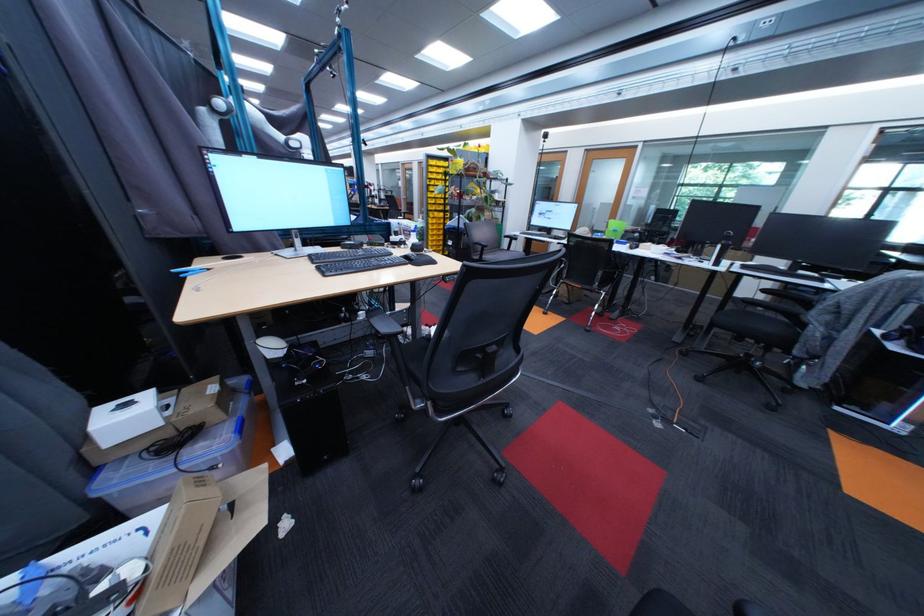
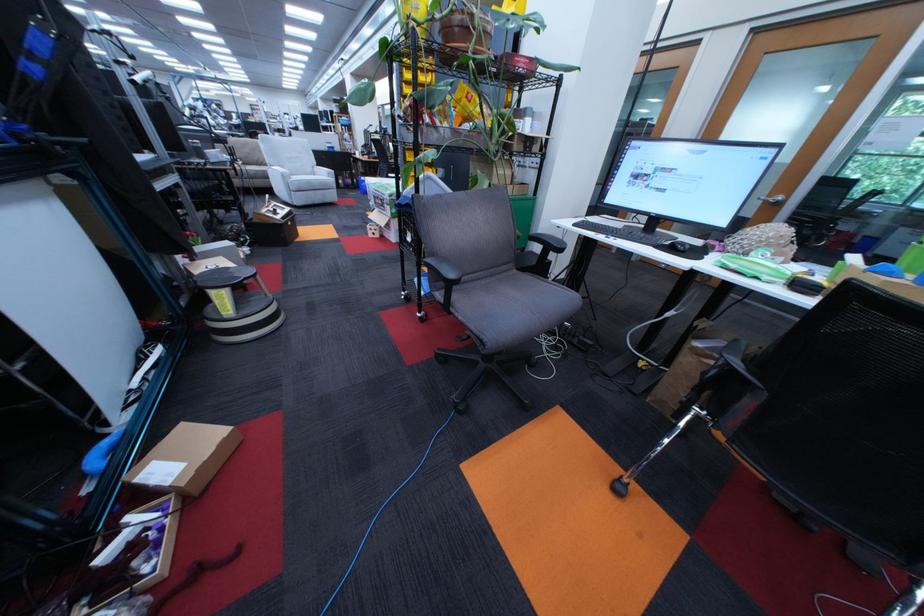
Locate, in the second image, the point that corresponds to the point at 521,241 in the first image.

(552, 249)